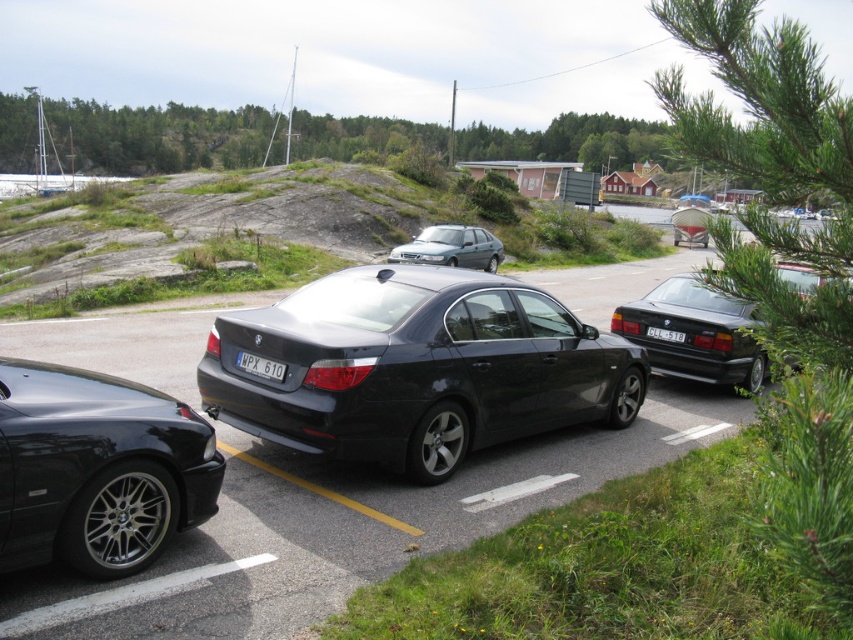
Is glossy black car at center shorter than glossy black sedan at right?

No, glossy black car at center is not shorter than glossy black sedan at right.

Who is lower down, glossy black car at center or glossy black sedan at right?

glossy black car at center is below.

Is point (421, 500) more distant than point (631, 307)?

No, it is in front of (631, 307).

At what (x,y) coordinates should I click in order to perform the action: click on glossy black car at center. Please return your answer as a coordinate pair (x, y). Image resolution: width=853 pixels, height=640 pixels. Looking at the image, I should click on (346, 525).

Does glossy black car at lower left lie in front of glossy black sedan at right?

Yes, it is.

Does point (96, 433) lie behind point (668, 310)?

No.

Which is in front, point (22, 364) or point (676, 298)?

Positioned in front is point (22, 364).

Find the location of a particular element. The height and width of the screenshot is (640, 853). glossy black car at lower left is located at coordinates (97, 468).

Which is behind, point (694, 280) or point (672, 332)?

Point (694, 280)

What do you see at coordinates (695, 333) in the screenshot? I see `glossy black sedan at right` at bounding box center [695, 333].

Who is more distant from viewer, (654,346) or (669,339)?

The point (654,346) is more distant.

The image size is (853, 640). Identify the location of glossy black sedan at right. (695, 333).